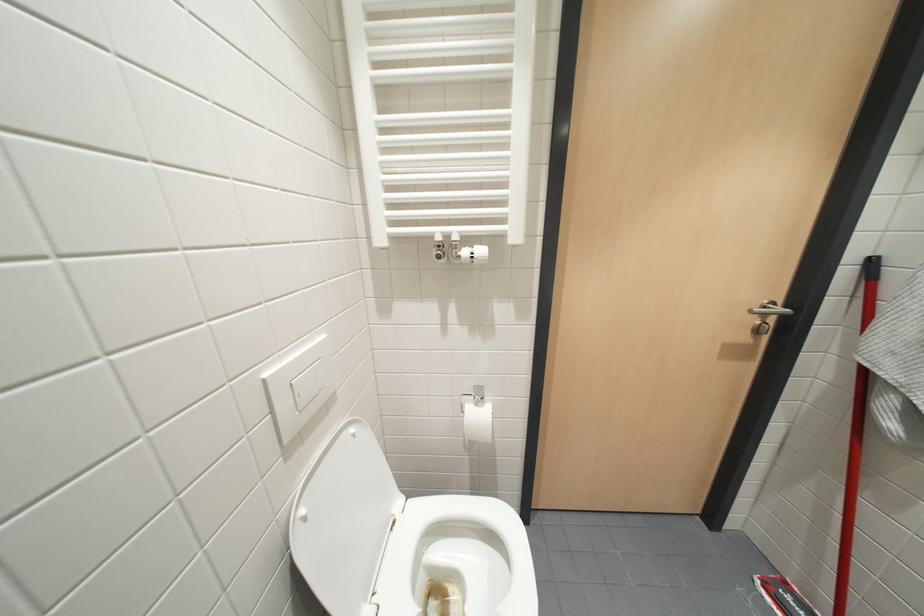
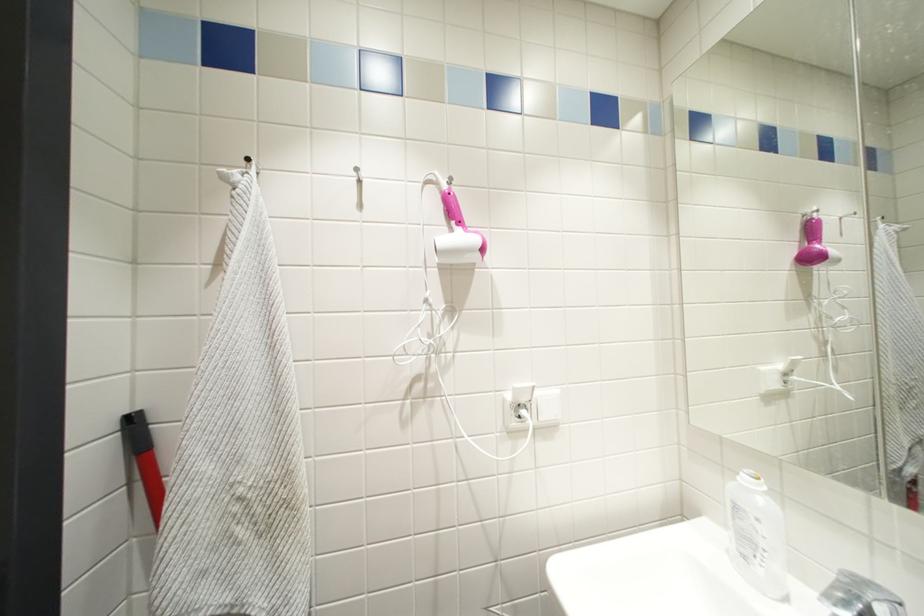
Question: How did the camera likely rotate?

Choices:
 (A) Left
 (B) Right
 (C) Up
 (D) Down

Answer: (B)